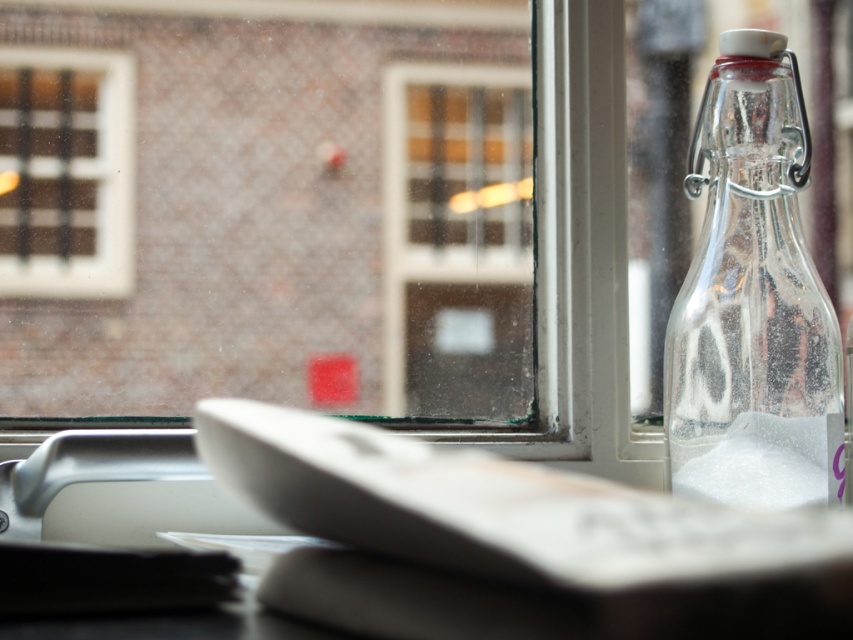
Question: Based on their relative distances, which object is farther from the matte white window at upper left?

Choices:
 (A) clear glass window at center
 (B) clear glass bottle at right
 (C) transparent glass window at center

Answer: (B)

Question: Can you confirm if clear glass window at center is bigger than transparent glass window at center?

Choices:
 (A) no
 (B) yes

Answer: (B)

Question: Which point is farther to the camera?

Choices:
 (A) (755, 465)
 (B) (57, 404)

Answer: (B)

Question: Does clear glass window at center have a larger size compared to matte white window at upper left?

Choices:
 (A) no
 (B) yes

Answer: (B)

Question: Estimate the real-world distances between objects in this image. Which object is closer to the matte white window at upper left?

Choices:
 (A) transparent glass window at center
 (B) clear glass window at center

Answer: (B)

Question: Is clear glass bottle at right in front of transparent glass window at center?

Choices:
 (A) no
 (B) yes

Answer: (B)